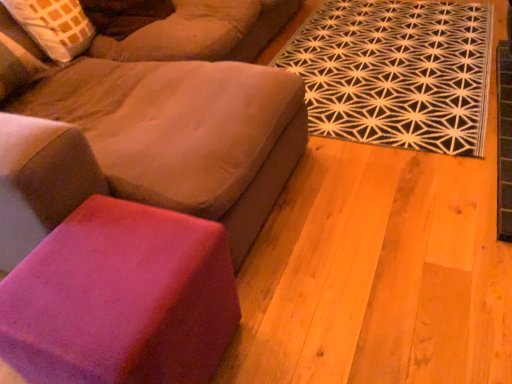
This screenshot has height=384, width=512. I want to click on black geometric rug at upper right, so click(396, 73).

Is purple suede stool at lower left facing away from suede-like beige studio couch at upper left?

No.

From a real-world perspective, which is physically above, purple suede stool at lower left or suede-like beige studio couch at upper left?

suede-like beige studio couch at upper left is physically above.

Between point (13, 270) and point (122, 111), which one is positioned in front?

The point (13, 270) is in front.

Who is smaller, purple suede stool at lower left or suede-like beige studio couch at upper left?

With smaller size is purple suede stool at lower left.

Considering their positions, is black geometric rug at upper right located in front of or behind purple suede stool at lower left?

In the image, black geometric rug at upper right appears behind purple suede stool at lower left.

From the image's perspective, which one is positioned lower, black geometric rug at upper right or purple suede stool at lower left?

From the image's view, purple suede stool at lower left is below.

In the scene shown: Considering the sizes of objects black geometric rug at upper right and purple suede stool at lower left in the image provided, who is wider, black geometric rug at upper right or purple suede stool at lower left?

Wider between the two is black geometric rug at upper right.

The image size is (512, 384). I want to click on studio couch that is in front of the purple suede stool at lower left, so click(x=166, y=119).

Is suede-like beige studio couch at upper left positioned far away from purple suede stool at lower left?

suede-like beige studio couch at upper left is actually quite close to purple suede stool at lower left.

Considering the sizes of suede-like beige studio couch at upper left and purple suede stool at lower left in the image, is suede-like beige studio couch at upper left taller or shorter than purple suede stool at lower left?

Clearly, suede-like beige studio couch at upper left is taller compared to purple suede stool at lower left.

From a real-world perspective, is suede-like beige studio couch at upper left physically below black geometric rug at upper right?

No, from a real-world perspective, suede-like beige studio couch at upper left is not below black geometric rug at upper right.

Looking at this image, in the image, is suede-like beige studio couch at upper left positioned in front of or behind black geometric rug at upper right?

Clearly, suede-like beige studio couch at upper left is in front of black geometric rug at upper right.

What's the angular difference between suede-like beige studio couch at upper left and black geometric rug at upper right's facing directions?

88.9 degrees separate the facing orientations of suede-like beige studio couch at upper left and black geometric rug at upper right.

Would you say suede-like beige studio couch at upper left is outside black geometric rug at upper right?

Absolutely, suede-like beige studio couch at upper left is external to black geometric rug at upper right.

From the image's perspective, between purple suede stool at lower left and black geometric rug at upper right, who is located below?

purple suede stool at lower left appears lower in the image.

Is purple suede stool at lower left facing away from black geometric rug at upper right?

purple suede stool at lower left does not have its back to black geometric rug at upper right.

Consider the image. Would you say purple suede stool at lower left is a long distance from black geometric rug at upper right?

purple suede stool at lower left is far away from black geometric rug at upper right.

The height and width of the screenshot is (384, 512). I want to click on stool on the left side of black geometric rug at upper right, so click(121, 299).

In the scene shown: Is black geometric rug at upper right bigger or smaller than suede-like beige studio couch at upper left?

In the image, black geometric rug at upper right appears to be smaller than suede-like beige studio couch at upper left.

Do you think black geometric rug at upper right is within suede-like beige studio couch at upper left, or outside of it?

black geometric rug at upper right cannot be found inside suede-like beige studio couch at upper left.

From a real-world perspective, is black geometric rug at upper right on suede-like beige studio couch at upper left?

Incorrect, from a real-world perspective, black geometric rug at upper right is lower than suede-like beige studio couch at upper left.

Considering the relative sizes of black geometric rug at upper right and suede-like beige studio couch at upper left in the image provided, is black geometric rug at upper right shorter than suede-like beige studio couch at upper left?

Yes.

You are a GUI agent. You are given a task and a screenshot of the screen. Output one action in this format:
    pyautogui.click(x=<x>, y=<y>)
    Task: Click on the stool directly beneath the suede-like beige studio couch at upper left (from a real-world perspective)
    The height and width of the screenshot is (384, 512).
    Given the screenshot: What is the action you would take?
    pyautogui.click(x=121, y=299)

You are a GUI agent. You are given a task and a screenshot of the screen. Output one action in this format:
    pyautogui.click(x=<x>, y=<y>)
    Task: Click on the stool in front of the black geometric rug at upper right
    The image size is (512, 384).
    Given the screenshot: What is the action you would take?
    pyautogui.click(x=121, y=299)

Based on their spatial positions, is purple suede stool at lower left or suede-like beige studio couch at upper left closer to black geometric rug at upper right?

suede-like beige studio couch at upper left is positioned closer to the anchor black geometric rug at upper right.

Looking at the image, which one is located closer to suede-like beige studio couch at upper left, black geometric rug at upper right or purple suede stool at lower left?

purple suede stool at lower left is positioned closer to the anchor suede-like beige studio couch at upper left.

Which object lies nearer to the anchor point purple suede stool at lower left, suede-like beige studio couch at upper left or black geometric rug at upper right?

suede-like beige studio couch at upper left is positioned closer to the anchor purple suede stool at lower left.

Based on their spatial positions, is purple suede stool at lower left or black geometric rug at upper right further from suede-like beige studio couch at upper left?

black geometric rug at upper right.

Looking at the image, which one is located closer to black geometric rug at upper right, suede-like beige studio couch at upper left or purple suede stool at lower left?

The object closer to black geometric rug at upper right is suede-like beige studio couch at upper left.

Which object lies further to the anchor point purple suede stool at lower left, black geometric rug at upper right or suede-like beige studio couch at upper left?

black geometric rug at upper right.

Where is `stool located between suede-like beige studio couch at upper left and black geometric rug at upper right in the left-right direction`? Image resolution: width=512 pixels, height=384 pixels. stool located between suede-like beige studio couch at upper left and black geometric rug at upper right in the left-right direction is located at coordinates (121, 299).